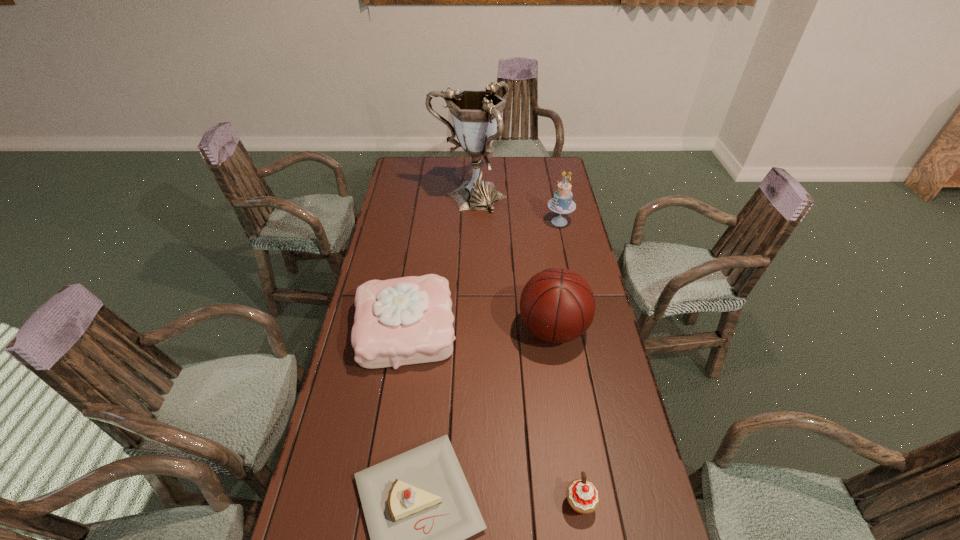
Locate an element on the screen. vacant space located 0.120m with a ladder on the side of the rightmost cake is located at coordinates (518, 222).

I want to click on vacant area situated 0.330m on the front of the basketball, so click(573, 461).

Locate an element on the screen. This screenshot has width=960, height=540. blank space located 0.140m on the right of the second nearest cake is located at coordinates (498, 328).

At what (x,y) coordinates should I click in order to perform the action: click on vacant position located 0.320m on the left of the cupcake. Please return your answer as a coordinate pair (x, y). Image resolution: width=960 pixels, height=540 pixels. Looking at the image, I should click on (435, 503).

Identify the location of object that is at the far edge. This screenshot has height=540, width=960. (476, 114).

This screenshot has height=540, width=960. What are the coordinates of `object that is at the left edge` in the screenshot? It's located at (408, 320).

Where is `cake present at the right edge`? cake present at the right edge is located at coordinates (562, 203).

Where is `basketball that is at the right edge`? The height and width of the screenshot is (540, 960). basketball that is at the right edge is located at coordinates (557, 305).

Locate an element on the screen. This screenshot has width=960, height=540. cupcake located at the right edge is located at coordinates (582, 495).

In the image, there is a desktop. At what (x,y) coordinates should I click in order to perform the action: click on free region at the far edge. Please return your answer as a coordinate pair (x, y). Looking at the image, I should click on (435, 173).